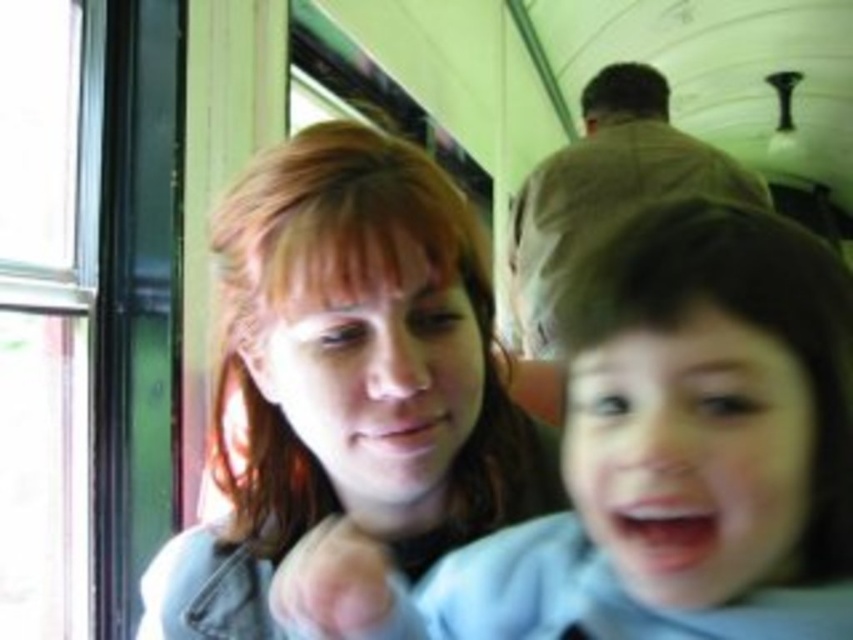
Can you confirm if smooth brown hair at center is thinner than brown fabric coach at upper center?

Yes, smooth brown hair at center is thinner than brown fabric coach at upper center.

Between point (335, 424) and point (514, 211), which one is positioned behind?

The point (514, 211) is more distant.

You are a GUI agent. You are given a task and a screenshot of the screen. Output one action in this format:
    pyautogui.click(x=<x>, y=<y>)
    Task: Click on the smooth brown hair at center
    The height and width of the screenshot is (640, 853).
    Given the screenshot: What is the action you would take?
    pyautogui.click(x=349, y=378)

How distant is smooth skin face at center from brown fabric coach at upper center?

smooth skin face at center and brown fabric coach at upper center are 1.39 meters apart from each other.

Who is more distant from viewer, (775, 396) or (585, 132)?

The point (585, 132) is behind.

Which is in front, point (834, 324) or point (527, 188)?

Point (834, 324) is more forward.

At what (x,y) coordinates should I click in order to perform the action: click on smooth skin face at center. Please return your answer as a coordinate pair (x, y). Looking at the image, I should click on (683, 433).

In the scene shown: Is smooth skin face at center to the right of smooth brown hair at center from the viewer's perspective?

Indeed, smooth skin face at center is positioned on the right side of smooth brown hair at center.

Between smooth skin face at center and smooth brown hair at center, which one is positioned higher?

smooth brown hair at center

Between point (622, 548) and point (398, 531), which one is positioned behind?

The point (398, 531) is behind.

Locate an element on the screen. The width and height of the screenshot is (853, 640). smooth skin face at center is located at coordinates (683, 433).